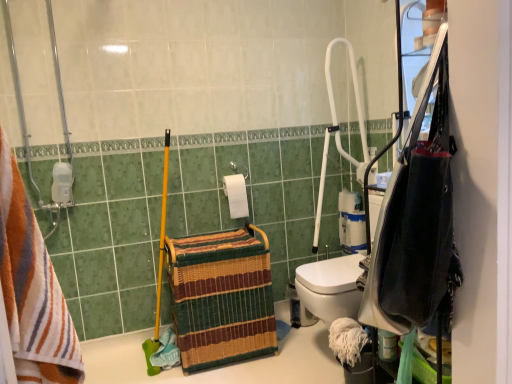
Question: Is white matte toilet paper at center, positioned as the 2th toilet paper in right-to-left order, shorter than woven straw basket at center?

Choices:
 (A) no
 (B) yes

Answer: (B)

Question: From the image's perspective, is white matte toilet paper at center, positioned as the 2th toilet paper in right-to-left order, beneath woven straw basket at center?

Choices:
 (A) yes
 (B) no

Answer: (B)

Question: Is woven straw basket at center a part of white matte toilet paper at center, the first toilet paper viewed from the left?

Choices:
 (A) no
 (B) yes

Answer: (A)

Question: Is there a large distance between white matte toilet paper at center, positioned as the 2th toilet paper in right-to-left order, and woven straw basket at center?

Choices:
 (A) no
 (B) yes

Answer: (A)

Question: Does white matte toilet paper at center, the first toilet paper viewed from the front, have a larger size compared to woven straw basket at center?

Choices:
 (A) no
 (B) yes

Answer: (A)

Question: Is white matte toilet paper at center, the first toilet paper viewed from the left, further to the viewer compared to woven straw basket at center?

Choices:
 (A) no
 (B) yes

Answer: (B)

Question: Can you confirm if white matte toilet paper at center, acting as the second toilet paper starting from the back, is thinner than white matte toilet paper at center-right, which is the 1th toilet paper in right-to-left order?

Choices:
 (A) yes
 (B) no

Answer: (A)

Question: Considering the relative sizes of white matte toilet paper at center, the first toilet paper viewed from the front, and white matte toilet paper at center-right, arranged as the 2th toilet paper when viewed from the front, in the image provided, is white matte toilet paper at center, the first toilet paper viewed from the front, shorter than white matte toilet paper at center-right, arranged as the 2th toilet paper when viewed from the front,?

Choices:
 (A) yes
 (B) no

Answer: (B)

Question: From the image's perspective, would you say white matte toilet paper at center, positioned as the 2th toilet paper in right-to-left order, is shown under white matte toilet paper at center-right, the second toilet paper in the left-to-right sequence?

Choices:
 (A) no
 (B) yes

Answer: (A)

Question: From a real-world perspective, does white matte toilet paper at center, positioned as the 2th toilet paper in right-to-left order, stand above white matte toilet paper at center-right, arranged as the first toilet paper when viewed from the back?

Choices:
 (A) no
 (B) yes

Answer: (B)

Question: Is the position of white matte toilet paper at center, the first toilet paper viewed from the front, less distant than that of white matte toilet paper at center-right, the second toilet paper in the left-to-right sequence?

Choices:
 (A) yes
 (B) no

Answer: (A)

Question: From the image's perspective, is white matte toilet paper at center, positioned as the 2th toilet paper in right-to-left order, on white matte toilet paper at center-right, arranged as the 2th toilet paper when viewed from the front?

Choices:
 (A) yes
 (B) no

Answer: (A)

Question: From the image's perspective, would you say white matte toilet paper at center, the first toilet paper viewed from the front, is positioned over white plastic shower at upper right?

Choices:
 (A) yes
 (B) no

Answer: (B)